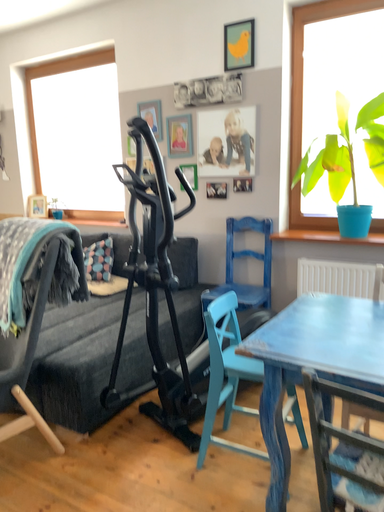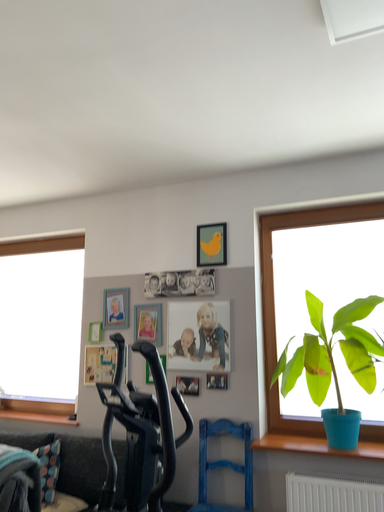
Question: How did the camera likely rotate when shooting the video?

Choices:
 (A) rotated left
 (B) rotated right

Answer: (B)